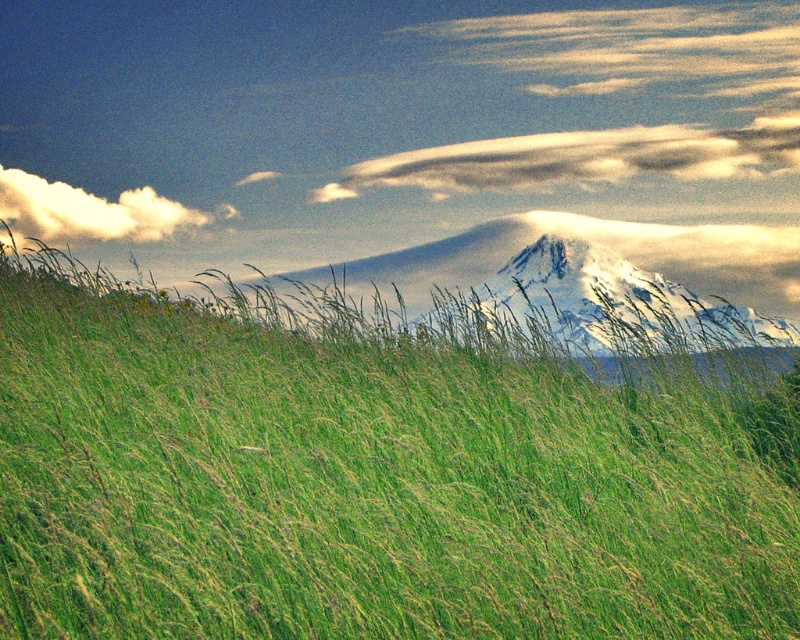
Does green grassy hillside at center appear on the left side of white fluffy cloud at upper left?

Incorrect, green grassy hillside at center is not on the left side of white fluffy cloud at upper left.

Does green grassy hillside at center have a lesser width compared to white fluffy cloud at upper left?

Yes.

Between point (356, 385) and point (29, 192), which one is positioned behind?

Positioned behind is point (29, 192).

Where is `green grassy hillside at center`? The height and width of the screenshot is (640, 800). green grassy hillside at center is located at coordinates (358, 492).